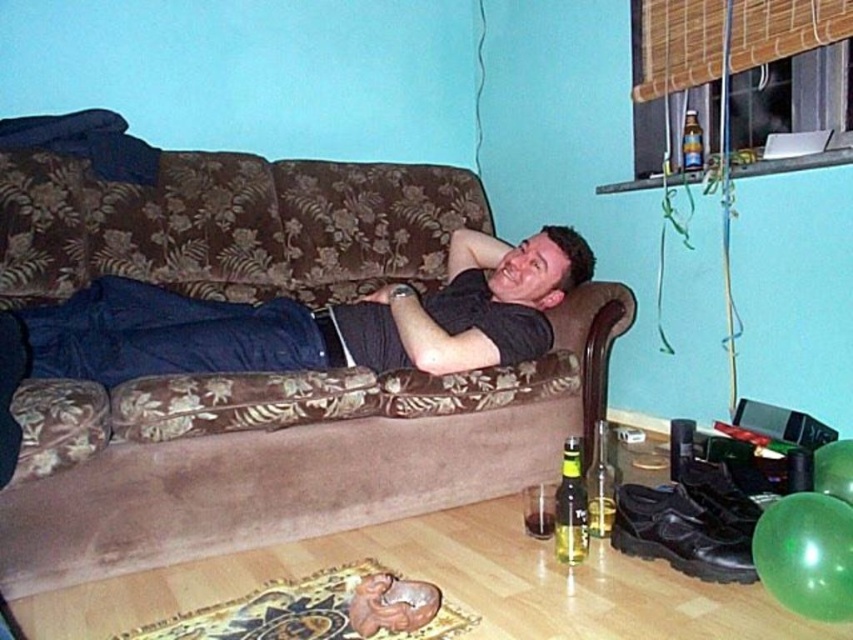
Question: Observing the image, what is the correct spatial positioning of green glass bottle at lower center in reference to translucent glass bottle at upper right?

Choices:
 (A) right
 (B) left

Answer: (B)

Question: Is green glass bottle at lower center bigger than translucent glass bottle at upper right?

Choices:
 (A) no
 (B) yes

Answer: (B)

Question: Which point is farther to the camera?

Choices:
 (A) (561, 532)
 (B) (488, 291)
 (C) (202, 429)
 (D) (691, 124)

Answer: (D)

Question: Which of the following is the farthest from the observer?

Choices:
 (A) (563, 493)
 (B) (144, 301)
 (C) (683, 161)
 (D) (48, 557)

Answer: (C)

Question: Which point is closer to the camera?

Choices:
 (A) translucent glass bottle at upper right
 (B) black matte shirt at center
 (C) green glass bottle at lower center
 (D) brown floral fabric couch at center

Answer: (D)

Question: Can you confirm if green glass bottle at lower center is positioned to the left of translucent glass bottle at upper right?

Choices:
 (A) yes
 (B) no

Answer: (A)